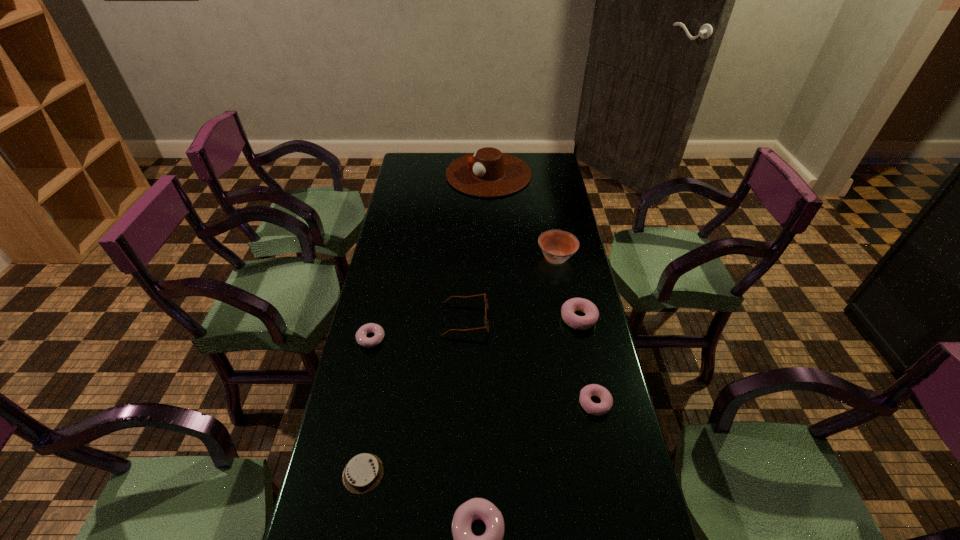
Find the location of `vacant point located on the back of the shortest object`. vacant point located on the back of the shortest object is located at coordinates (390, 329).

What are the coordinates of `object situated at the far edge` in the screenshot? It's located at (488, 172).

Where is `doughnut that is at the left edge`? This screenshot has height=540, width=960. doughnut that is at the left edge is located at coordinates (361, 335).

Identify the location of chocolate cake that is positioned at the left edge. The image size is (960, 540). (363, 472).

Identify the location of cowboy hat present at the right edge. (488, 172).

This screenshot has height=540, width=960. What are the coordinates of `bowl positioned at the right edge` in the screenshot? It's located at tap(557, 246).

Where is `object that is at the far right corner`? object that is at the far right corner is located at coordinates (488, 172).

Identify the location of vacant space at the left edge of the desktop. (391, 289).

The image size is (960, 540). What are the coordinates of `vacant space at the right edge` in the screenshot? It's located at (581, 532).

Image resolution: width=960 pixels, height=540 pixels. In the image, there is a desktop. What are the coordinates of `vacant space at the far left corner` in the screenshot? It's located at 419,172.